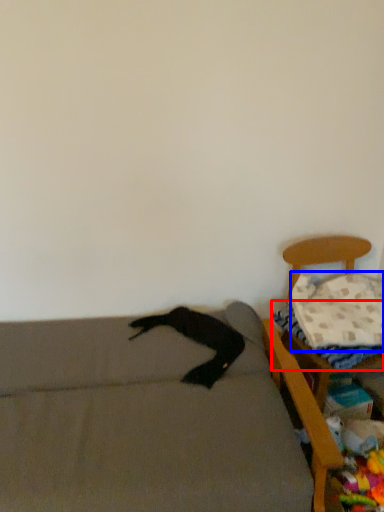
Question: Which of the following is the farthest to the observer, sheet (highlighted by a red box) or pillow (highlighted by a blue box)?

Choices:
 (A) sheet
 (B) pillow

Answer: (B)